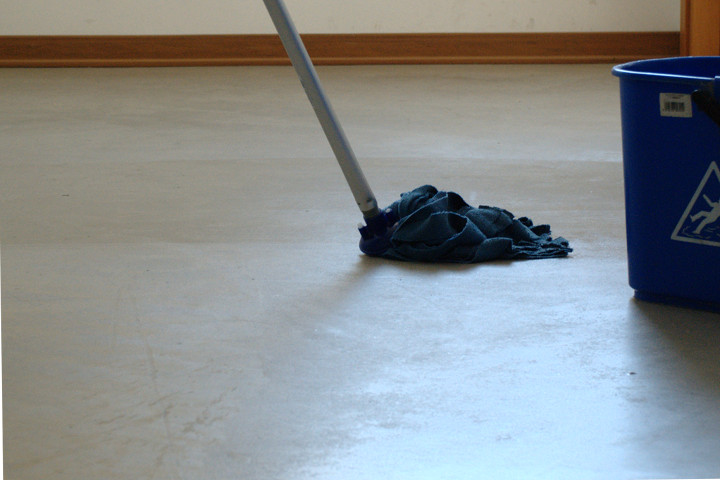
I want to click on blue bucket, so (657, 175).